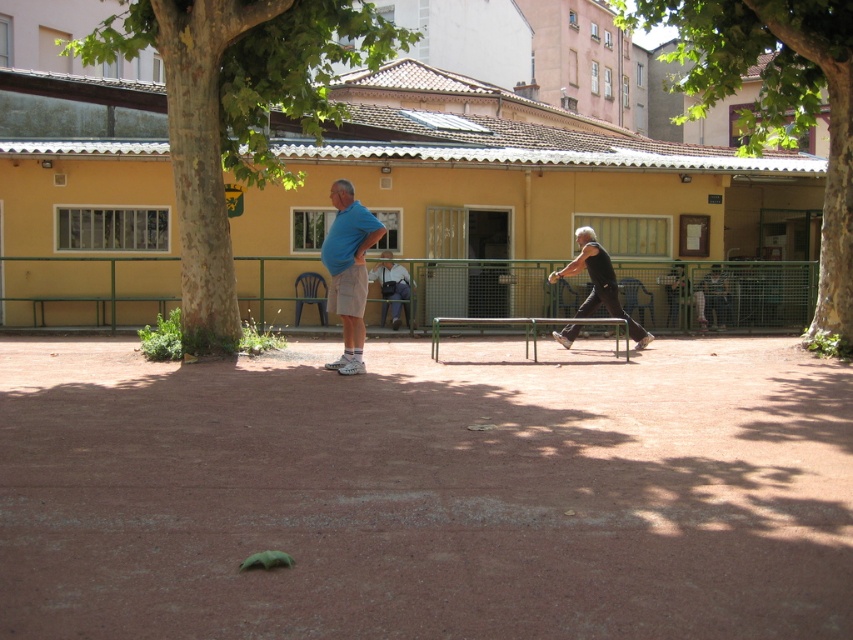
Which is in front, point (218, 84) or point (717, 32)?

Point (218, 84) is in front.

Which is behind, point (210, 195) or point (732, 80)?

The point (732, 80) is more distant.

Locate an element on the screen. The height and width of the screenshot is (640, 853). green rough bark tree at left is located at coordinates pos(235,113).

Is green leafy tree at center below dark gray fabric jacket at center?

Actually, green leafy tree at center is above dark gray fabric jacket at center.

Is green leafy tree at center to the left of dark gray fabric jacket at center from the viewer's perspective?

Incorrect, green leafy tree at center is not on the left side of dark gray fabric jacket at center.

Between point (770, 97) and point (666, 296), which one is positioned in front?

Positioned in front is point (770, 97).

Where is `green leafy tree at center`? This screenshot has width=853, height=640. green leafy tree at center is located at coordinates point(776,100).

Consider the image. Between green rough bark tree at left and black sleeveless shirt at right, which one has more height?

With more height is green rough bark tree at left.

You are a GUI agent. You are given a task and a screenshot of the screen. Output one action in this format:
    pyautogui.click(x=<x>, y=<y>)
    Task: Click on the green rough bark tree at left
    The height and width of the screenshot is (640, 853).
    Given the screenshot: What is the action you would take?
    pyautogui.click(x=235, y=113)

Is point (407, 35) positioned before point (599, 294)?

Yes, it is in front of point (599, 294).

Image resolution: width=853 pixels, height=640 pixels. Identify the location of green rough bark tree at left. (235, 113).